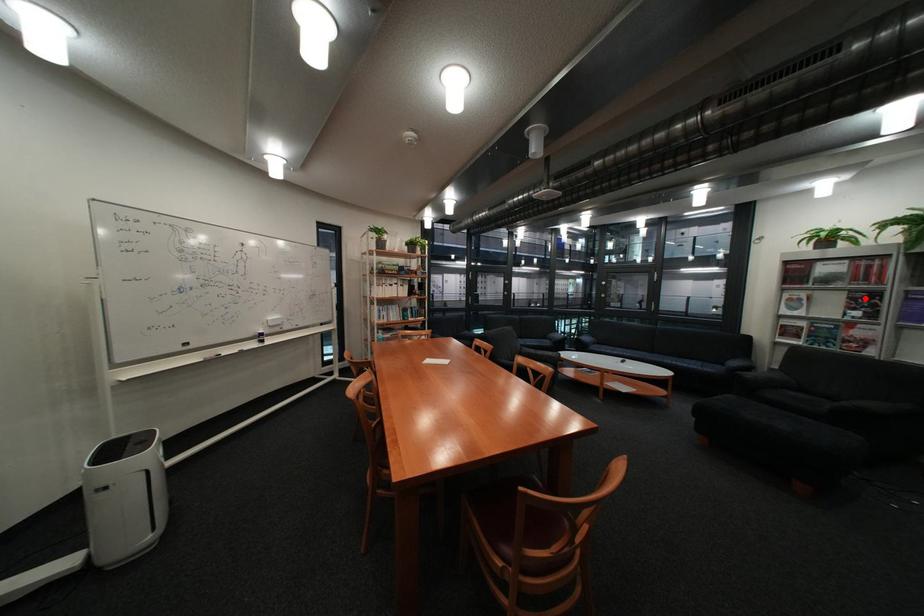
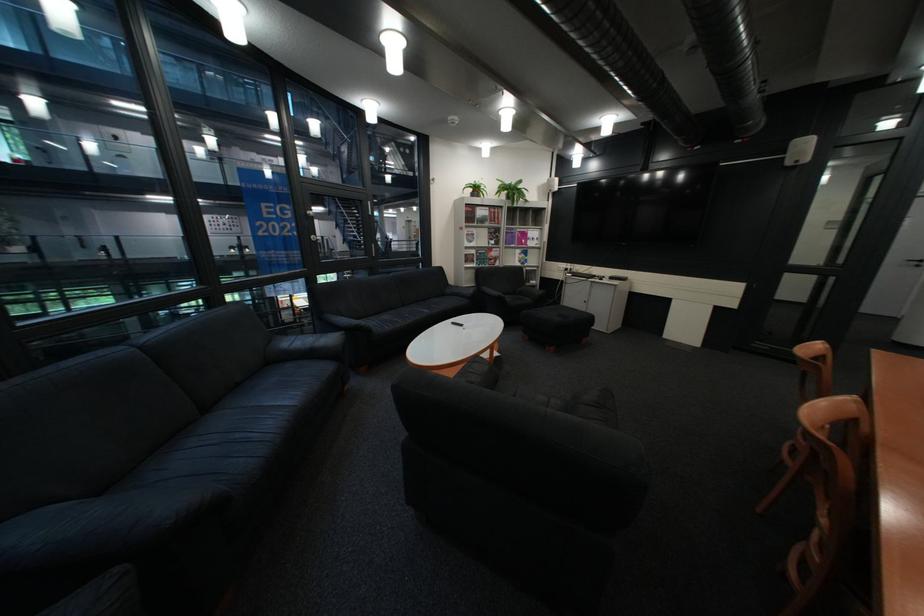
Locate, in the second image, the point that corresponds to the highlighted location in the first image.

(505, 233)